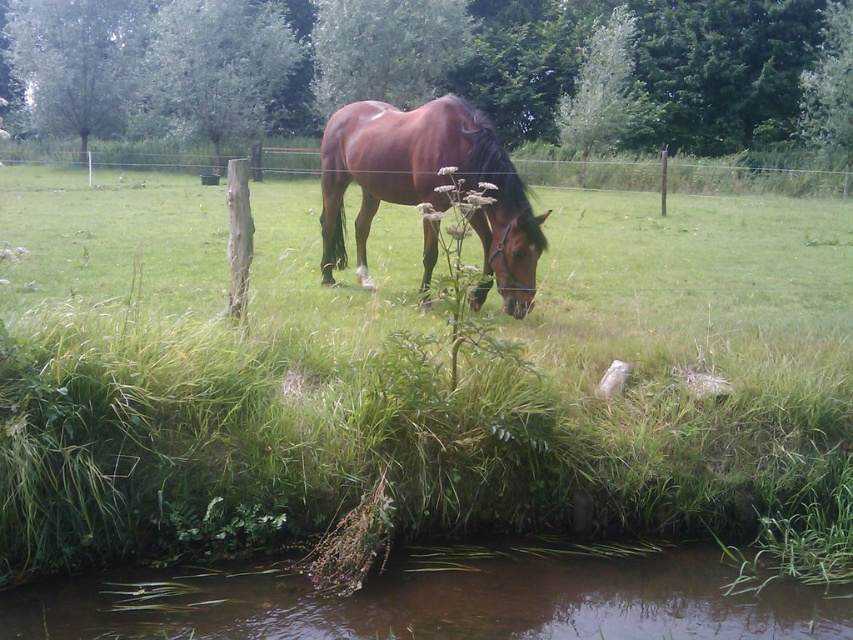
You are a photographer standing at the edge of the stream. You want to take a picture of the shiny brown horse at center without the brown muddy water at lower center appearing in the foreground. Is this possible?

The brown muddy water at lower center is in front of the shiny brown horse at center, so it will block the view of the horse. Therefore, you cannot take a picture of the shiny brown horse at center without the brown muddy water at lower center appearing in the foreground.

You are standing at the point marked as point (415,380) in the image. What is the immediate ground cover at your feet?

The immediate ground cover at your feet is green grassy at center.